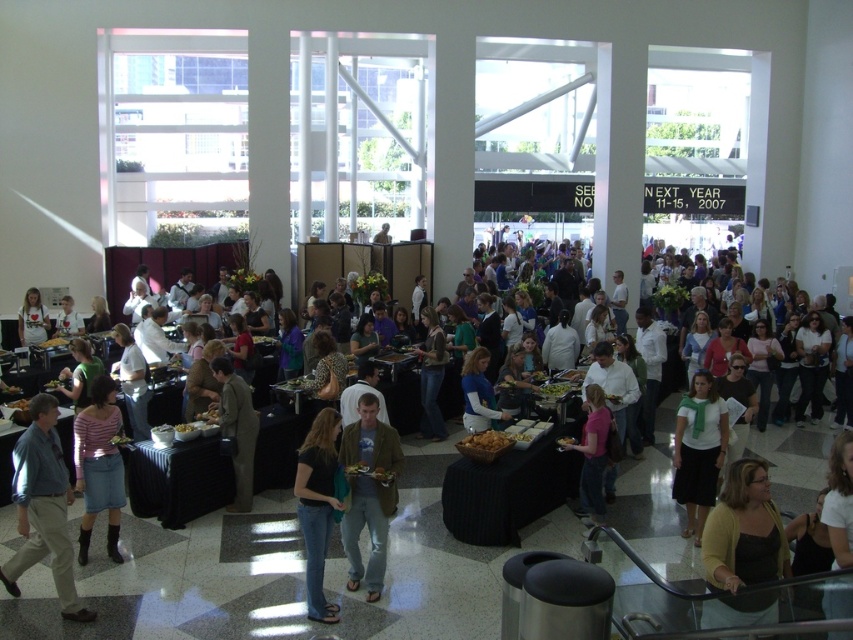
You are at a buffet event and want to reach the light brown leather jacket at center without stepping on the black denim jeans at center. Is this possible?

The black denim jeans at center is in front of the light brown leather jacket at center, so you can walk around the black denim jeans at center to reach the light brown leather jacket at center without stepping on it.

Looking at this image, you are at the buffet and want to grab a snack from the table. There are two items at the center of the table, a black denim jeans at center and a light brown leather jacket at center. Which item is closer to the floor?

The black denim jeans at center is located below the light brown leather jacket at center, so it is closer to the floor.

You are organizing a photo shoot in the event space and need to ensure that the dark brown leather jacket at center and the matte blue shirt at center are visible in the frame. Since the camera has a limited focus range, which object should you prioritize to ensure it is fully in focus, considering their sizes?

The dark brown leather jacket at center is bigger than the matte blue shirt at center, so you should prioritize focusing on the dark brown leather jacket at center to ensure it fits within the camera frame.